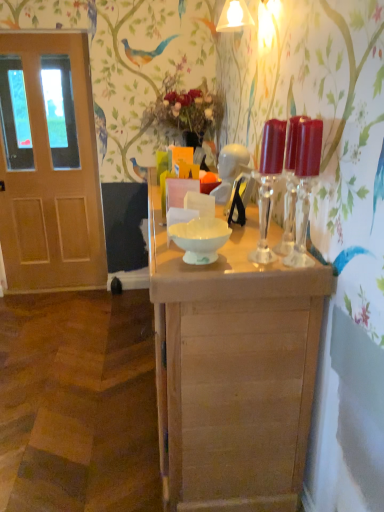
Where is `free location in front of transparent glass candle holders at center, marked as the 1th candle holder in a left-to-right arrangement`? Image resolution: width=384 pixels, height=512 pixels. free location in front of transparent glass candle holders at center, marked as the 1th candle holder in a left-to-right arrangement is located at coordinates (268, 275).